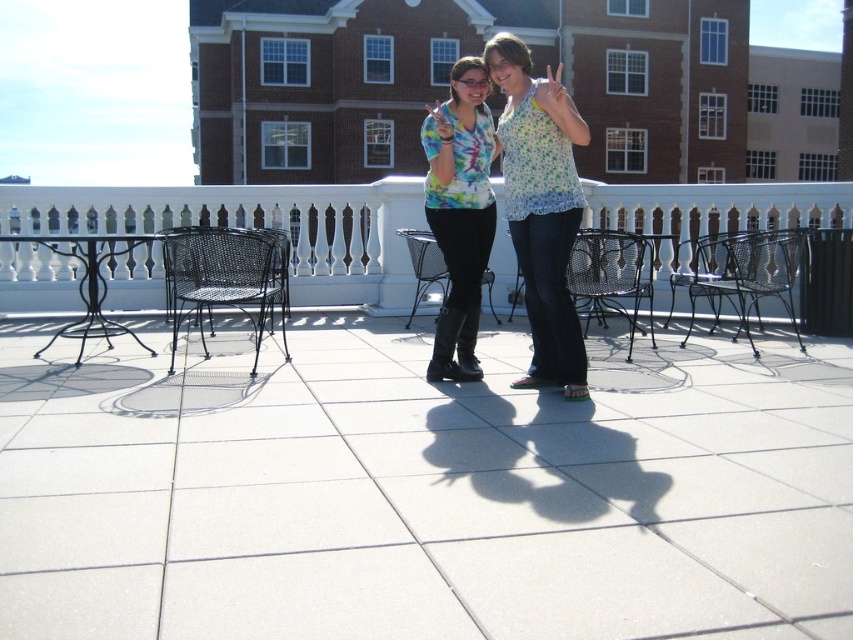
Question: Which object appears closest to the camera in this image?

Choices:
 (A) white tile balcony at center
 (B) tie-dye fabric shirt at center

Answer: (B)

Question: Which point is closer to the camera?

Choices:
 (A) (538, 264)
 (B) (701, 211)

Answer: (A)

Question: Is floral fabric blouse at center bigger than black wicker chair at left?

Choices:
 (A) no
 (B) yes

Answer: (A)

Question: Observing the image, what is the correct spatial positioning of floral fabric blouse at center in reference to black metal bench at right?

Choices:
 (A) right
 (B) left

Answer: (B)

Question: Is floral fabric blouse at center bigger than black metal bench at right?

Choices:
 (A) yes
 (B) no

Answer: (B)

Question: Which of the following is the farthest from the observer?

Choices:
 (A) white tile balcony at center
 (B) black wicker chair at left

Answer: (A)